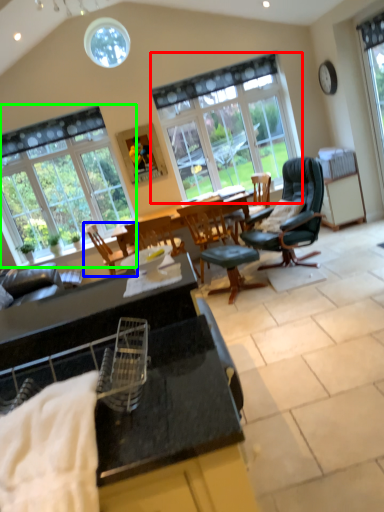
Question: Based on their relative distances, which object is farther from window (highlighted by a red box)? Choose from chair (highlighted by a blue box) and window (highlighted by a green box).

Choices:
 (A) chair
 (B) window

Answer: (A)